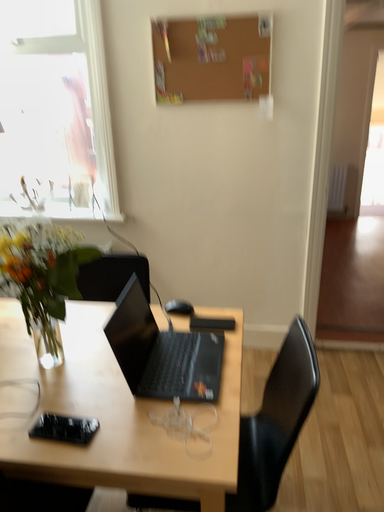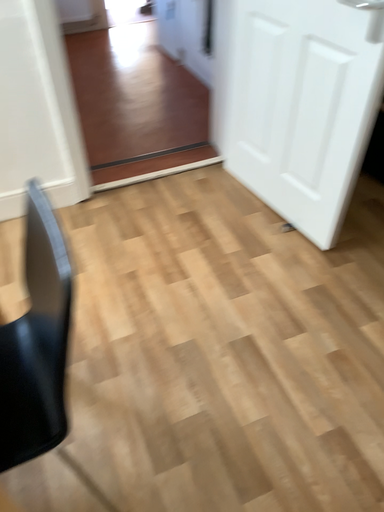
Question: How did the camera likely rotate when shooting the video?

Choices:
 (A) rotated right
 (B) rotated left

Answer: (A)